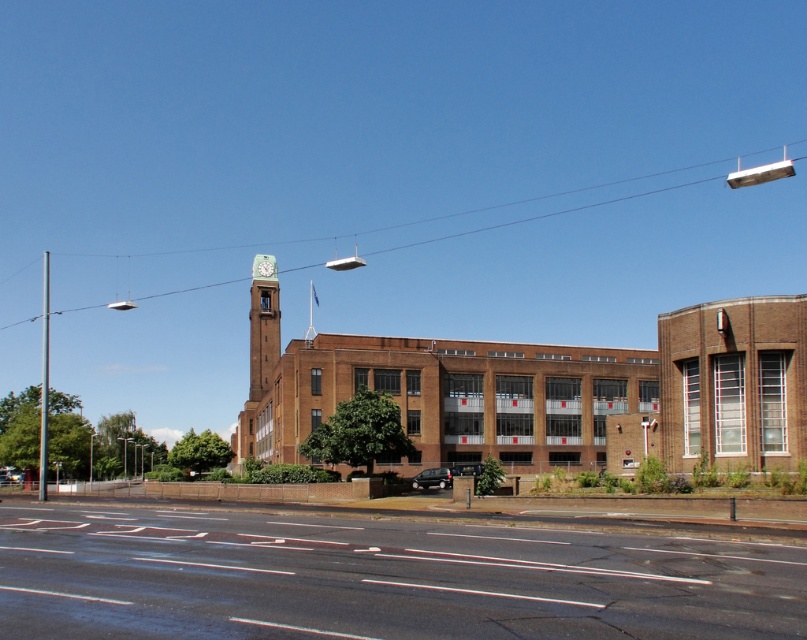
Question: Which point is closer to the camera?

Choices:
 (A) [257, 269]
 (B) [396, 570]

Answer: (B)

Question: Does black asphalt road at lower center appear on the left side of green painted brick clock tower at upper center?

Choices:
 (A) no
 (B) yes

Answer: (A)

Question: Which object appears farthest from the camera in this image?

Choices:
 (A) black asphalt road at lower center
 (B) green painted brick clock tower at upper center
 (C) matte red clock at center
 (D) shiny black car at center

Answer: (C)

Question: Among these points, which one is farthest from the camera?

Choices:
 (A) (424, 477)
 (B) (261, 266)
 (C) (268, 291)

Answer: (B)

Question: Can you confirm if green painted brick clock tower at upper center is bigger than shiny black car at center?

Choices:
 (A) yes
 (B) no

Answer: (A)

Question: Does green painted brick clock tower at upper center appear under matte red clock at center?

Choices:
 (A) no
 (B) yes

Answer: (B)